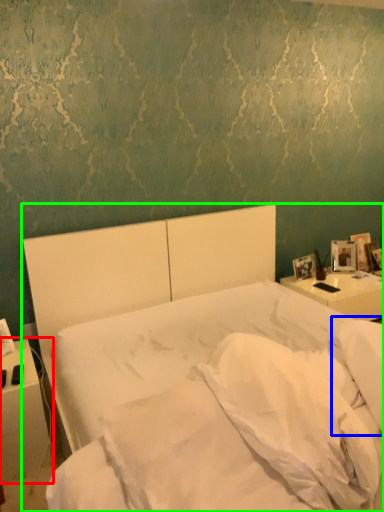
Question: Estimate the real-world distances between objects in this image. Which object is farther from nightstand (highlighted by a red box), pillow (highlighted by a blue box) or bed (highlighted by a green box)?

Choices:
 (A) pillow
 (B) bed

Answer: (A)